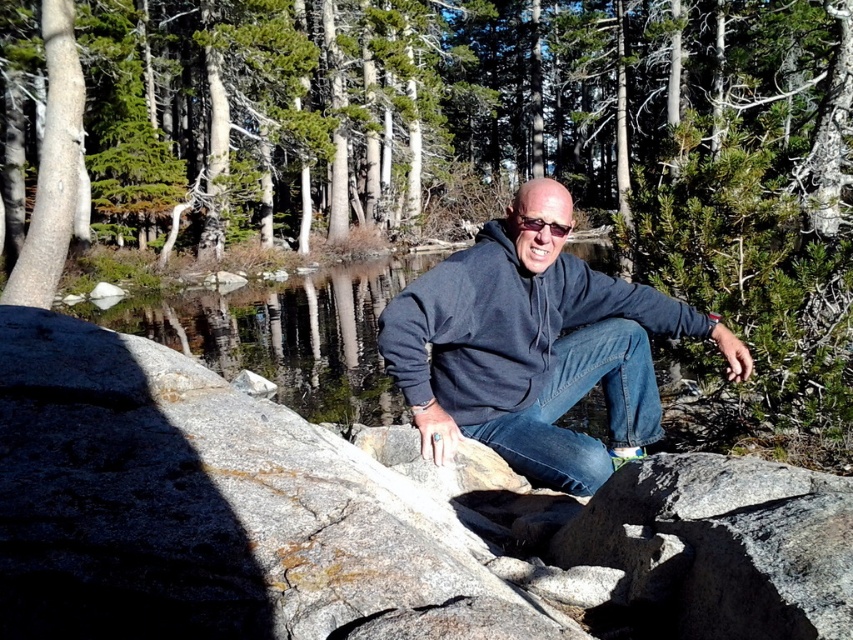
You are a hiker who wants to take a photo of the dark blue hoodie at center and the green textured pine tree at upper center. Which object should you focus on first to ensure both are in focus?

You should focus on the green textured pine tree at upper center first because the dark blue hoodie at center is behind it, ensuring both will be in focus when focusing on the closer object.

You are a hiker who wants to take a photo of the denim at center without the green textured pine tree at upper center blocking the view. Is the pine tree wider than the denim area? Please explain.

The green textured pine tree at upper center is wider than the denim at center. Therefore, the pine tree would block the view of the denim area if positioned in front.

Based on the photo, you are a hiker who wants to take a photo of the dark blue hoodie at center and the green textured pine tree at upper center. Which object should you focus on first if you want both to be in sharp focus, considering their sizes?

The green textured pine tree at upper center is wider than the dark blue hoodie at center, so focusing on the tree will ensure both are in focus as it covers more area.